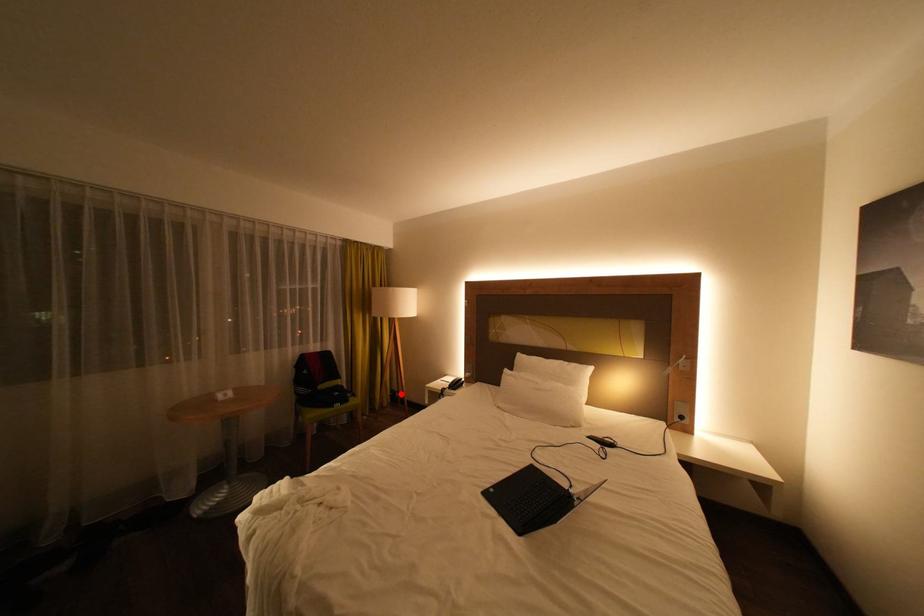
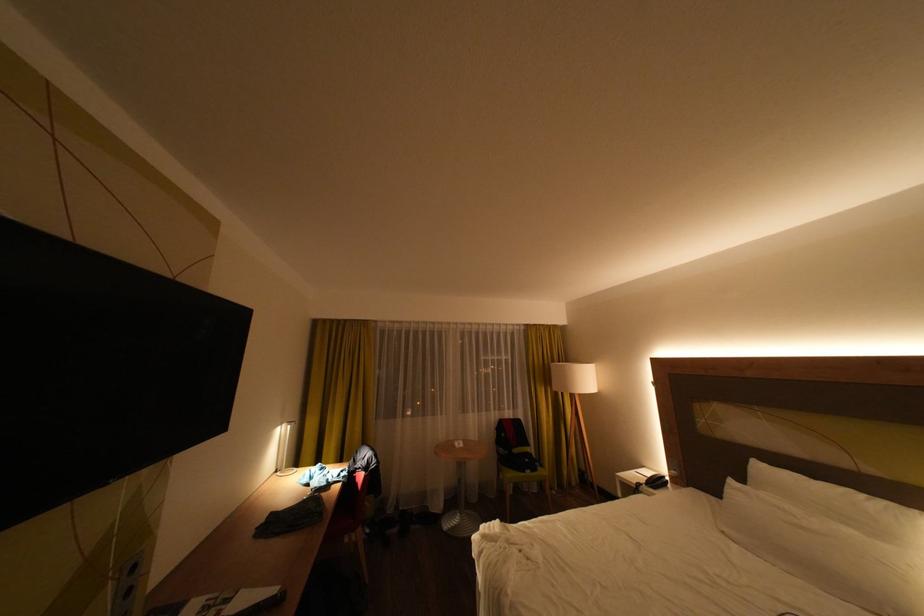
Question: I am providing you with two images of the same scene from different viewpoints. A red point is marked on the first image. At the location where the point appears in image 1, is it still visible in image 2?

Choices:
 (A) Yes
 (B) No

Answer: (A)